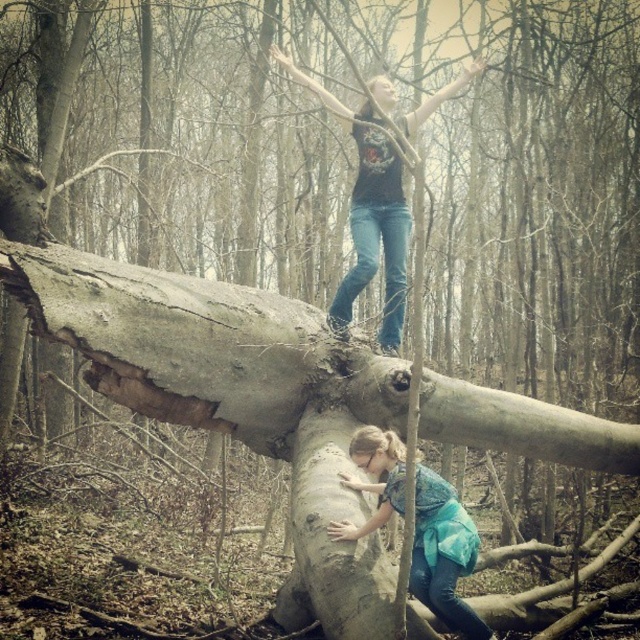
You are a photographer positioned in the forest scene. You notice two points marked on the large fallen tree trunk. Which of these points, point (x=316, y=408) or point (x=349, y=298), is closer to your current position?

Point (x=316, y=408) is closer to the viewer than point (x=349, y=298).

Based on the photo, you are a photographer trying to capture the scene of the two points on the tree trunk. Which point, point (x=321, y=616) or point (x=380, y=483), would appear larger in your photo?

Point (x=321, y=616) is closer to the camera than point (x=380, y=483), so it would appear larger in the photo.

You are a photographer trying to capture a shot of the smooth gray log at lower center and the blue denim jeans at lower center. Your camera can only focus on objects within 20 centimeters of each other. Can you take a clear photo of both subjects at the same time?

The distance between the smooth gray log at lower center and the blue denim jeans at lower center is 22.60 centimeters. Since the camera requires objects to be within 20 centimeters for clear focus, the subjects are too far apart for a clear photo.